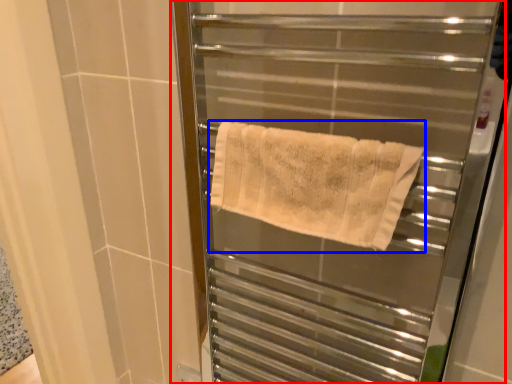
Question: Among these objects, which one is nearest to the camera, screen door (highlighted by a red box) or towel (highlighted by a blue box)?

Choices:
 (A) screen door
 (B) towel

Answer: (A)